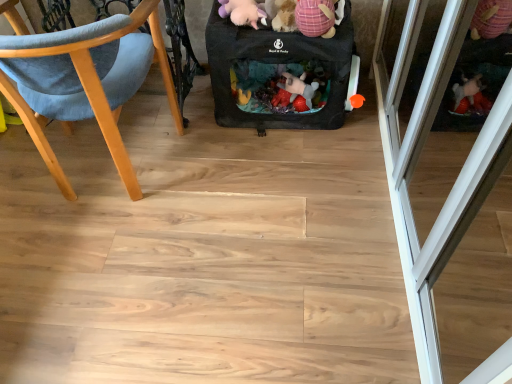
Where is `vacant area that lies between transparent glass screen door at right and black fabric baby carriage at center`? This screenshot has height=384, width=512. vacant area that lies between transparent glass screen door at right and black fabric baby carriage at center is located at coordinates (313, 210).